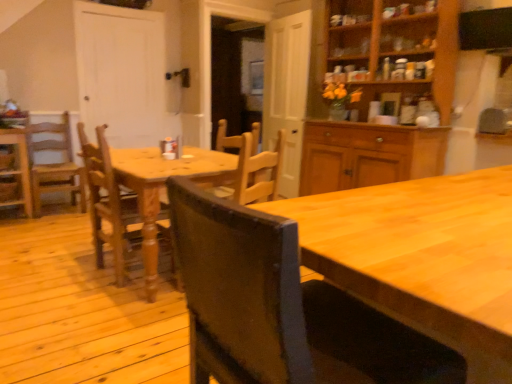
Locate an element on the screen. Image resolution: width=512 pixels, height=384 pixels. wooden chair at left, which is the 2th chair in back-to-front order is located at coordinates (19, 168).

Based on the photo, what is the approximate height of black matte exhaust hood at upper right?

30.41 centimeters.

Measure the distance between black matte exhaust hood at upper right and camera.

The depth of black matte exhaust hood at upper right is 3.24 meters.

You are a GUI agent. You are given a task and a screenshot of the screen. Output one action in this format:
    pyautogui.click(x=<x>, y=<y>)
    Task: Click on the wooden chair at center, the first chair when ordered from right to left
    The width and height of the screenshot is (512, 384).
    Given the screenshot: What is the action you would take?
    282,308

Where is `wooden table at center`? wooden table at center is located at coordinates (147, 196).

How different are the orientations of wooden chair at center, which appears as the second chair when viewed from the front, and black matte exhaust hood at upper right in degrees?

The angle between the facing direction of wooden chair at center, which appears as the second chair when viewed from the front, and the facing direction of black matte exhaust hood at upper right is 180 degrees.

Could you tell me if wooden chair at center, which ranks as the 3th chair in back-to-front order, is turned towards black matte exhaust hood at upper right?

No, wooden chair at center, which ranks as the 3th chair in back-to-front order, does not turn towards black matte exhaust hood at upper right.

From the image's perspective, is wooden chair at center, which ranks as the 3th chair in back-to-front order, positioned above or below black matte exhaust hood at upper right?

From the image's perspective, wooden chair at center, which ranks as the 3th chair in back-to-front order, appears below black matte exhaust hood at upper right.

I want to click on exhaust hood above the wooden chair at center, which appears as the 2th chair when viewed from the right (from a real-world perspective), so click(x=486, y=30).

Which is behind, wooden chair at left, which is the 2th chair in back-to-front order, or light brown wooden chair at left, the first chair positioned from the back?

light brown wooden chair at left, the first chair positioned from the back, is further from the camera.

You are a GUI agent. You are given a task and a screenshot of the screen. Output one action in this format:
    pyautogui.click(x=<x>, y=<y>)
    Task: Click on the chair beneath the light brown wooden chair at left, acting as the 4th chair starting from the front (from a real-world perspective)
    The width and height of the screenshot is (512, 384).
    Given the screenshot: What is the action you would take?
    pyautogui.click(x=19, y=168)

Which is behind, point (26, 173) or point (51, 132)?

The point (51, 132) is more distant.

Which is correct: wooden chair at left, the fourth chair viewed from the right, is inside light brown wooden chair at left, acting as the 4th chair starting from the front, or outside of it?

wooden chair at left, the fourth chair viewed from the right, is outside light brown wooden chair at left, acting as the 4th chair starting from the front.

What's the angular difference between wooden chair at center, placed as the third chair when sorted from left to right, and wooden table at center's facing directions?

The angular difference between wooden chair at center, placed as the third chair when sorted from left to right, and wooden table at center is 0.587 degrees.

Where is `kitchen & dining room table on the right of wooden chair at center, which appears as the 2th chair when viewed from the right`? Image resolution: width=512 pixels, height=384 pixels. kitchen & dining room table on the right of wooden chair at center, which appears as the 2th chair when viewed from the right is located at coordinates (147, 196).

Between wooden chair at center, placed as the third chair when sorted from left to right, and wooden table at center, which one has smaller width?

With smaller width is wooden chair at center, placed as the third chair when sorted from left to right.

Would you say wooden chair at center, placed as the third chair when sorted from left to right, contains wooden table at center?

Definitely not — wooden table at center is not inside wooden chair at center, placed as the third chair when sorted from left to right.

Is black matte exhaust hood at upper right wider than wooden chair at left, which is the first chair in left-to-right order?

In fact, black matte exhaust hood at upper right might be narrower than wooden chair at left, which is the first chair in left-to-right order.

Considering the positions of objects black matte exhaust hood at upper right and wooden chair at left, which is the 2th chair in back-to-front order, in the image provided, who is behind, black matte exhaust hood at upper right or wooden chair at left, which is the 2th chair in back-to-front order,?

wooden chair at left, which is the 2th chair in back-to-front order, is further from the camera.

This screenshot has width=512, height=384. In order to click on exhaust hood that is in front of the wooden chair at left, the fourth chair viewed from the right in this screenshot , I will do click(x=486, y=30).

Is light brown wooden chair at left, the first chair positioned from the back, inside the boundaries of wooden chair at left, the third chair in the front-to-back sequence, or outside?

light brown wooden chair at left, the first chair positioned from the back, is not inside wooden chair at left, the third chair in the front-to-back sequence, it's outside.

Is light brown wooden chair at left, the first chair positioned from the back, further to camera compared to wooden chair at left, the fourth chair viewed from the right?

Yes, it is behind wooden chair at left, the fourth chair viewed from the right.

Is light brown wooden chair at left, arranged as the third chair when viewed from the right, positioned far away from wooden chair at left, which is the first chair in left-to-right order?

No, light brown wooden chair at left, arranged as the third chair when viewed from the right, is in close proximity to wooden chair at left, which is the first chair in left-to-right order.

Can you tell me how much light brown wooden chair at left, arranged as the third chair when viewed from the right, and wooden chair at left, the fourth chair viewed from the right, differ in facing direction?

1.06 degrees.

From the image's perspective, is light brown wooden chair at left, placed as the second chair when sorted from left to right, on top of wooden table at center?

Yes.

Looking at this image, can you confirm if light brown wooden chair at left, arranged as the third chair when viewed from the right, is smaller than wooden table at center?

Yes, light brown wooden chair at left, arranged as the third chair when viewed from the right, is smaller than wooden table at center.

Identify the location of kitchen & dining room table that is under the light brown wooden chair at left, acting as the 4th chair starting from the front (from a real-world perspective). The image size is (512, 384). (147, 196).

Considering the relative positions of light brown wooden chair at left, acting as the 4th chair starting from the front, and wooden table at center in the image provided, is light brown wooden chair at left, acting as the 4th chair starting from the front, to the left of wooden table at center from the viewer's perspective?

Yes.

Is wooden cabinet at upper right oriented away from wooden table at center?

No, wooden cabinet at upper right is not facing the opposite direction of wooden table at center.

In the scene shown: Considering the relative positions of wooden cabinet at upper right and wooden table at center in the image provided, is wooden cabinet at upper right behind wooden table at center?

Yes, it is behind wooden table at center.

From a real-world perspective, is wooden cabinet at upper right positioned above or below wooden table at center?

From a real-world perspective, wooden cabinet at upper right is physically above wooden table at center.

The height and width of the screenshot is (384, 512). What are the coordinates of `kitchen & dining room table to the left of wooden cabinet at upper right` in the screenshot? It's located at (147, 196).

Where is `exhaust hood on the right of wooden chair at center, which appears as the 2th chair when viewed from the right`? exhaust hood on the right of wooden chair at center, which appears as the 2th chair when viewed from the right is located at coordinates (486, 30).

The height and width of the screenshot is (384, 512). What are the coordinates of `chair below the light brown wooden chair at left, arranged as the third chair when viewed from the right (from a real-world perspective)` in the screenshot? It's located at (19, 168).

Looking at the image, which one is located further to wooden chair at center, which ranks as the 3th chair in back-to-front order, black matte exhaust hood at upper right or light brown wooden chair at left, arranged as the third chair when viewed from the right?

black matte exhaust hood at upper right.

In the scene shown: Considering their positions, is wooden chair at center, the fourth chair positioned from the left, positioned closer to light brown wooden chair at left, placed as the second chair when sorted from left to right, than wooden chair at center, which ranks as the 3th chair in back-to-front order?

Among the two, wooden chair at center, which ranks as the 3th chair in back-to-front order, is located nearer to light brown wooden chair at left, placed as the second chair when sorted from left to right.

From the image, which object appears to be nearer to wooden chair at left, which is the 2th chair in back-to-front order, wooden chair at center, which ranks as the 3th chair in back-to-front order, or wooden table at center?

wooden chair at center, which ranks as the 3th chair in back-to-front order, lies closer to wooden chair at left, which is the 2th chair in back-to-front order, than the other object.

Considering their positions, is wooden chair at left, which is the 2th chair in back-to-front order, positioned further to light brown wooden chair at left, placed as the second chair when sorted from left to right, than wooden chair at center, which appears as the second chair when viewed from the front?

Based on the image, wooden chair at center, which appears as the second chair when viewed from the front, appears to be further to light brown wooden chair at left, placed as the second chair when sorted from left to right.

Based on their spatial positions, is wooden cabinet at upper right or wooden table at center further from wooden chair at center, the fourth chair positioned from the left?

wooden cabinet at upper right lies further to wooden chair at center, the fourth chair positioned from the left, than the other object.

Considering their positions, is wooden chair at center, the first chair when ordered from right to left, positioned closer to wooden cabinet at upper right than wooden table at center?

Based on the image, wooden table at center appears to be nearer to wooden cabinet at upper right.

Based on the photo, from the image, which object appears to be farther from wooden cabinet at upper right, black matte exhaust hood at upper right or wooden table at center?

wooden table at center.

Which object lies further to the anchor point wooden chair at center, which is the fourth chair in back-to-front order, black matte exhaust hood at upper right or light brown wooden chair at left, the first chair positioned from the back?

light brown wooden chair at left, the first chair positioned from the back, is further to wooden chair at center, which is the fourth chair in back-to-front order.

Where is `kitchen & dining room table between wooden chair at left, which is the first chair in left-to-right order, and black matte exhaust hood at upper right`? kitchen & dining room table between wooden chair at left, which is the first chair in left-to-right order, and black matte exhaust hood at upper right is located at coordinates (147, 196).

Where is `cabinetry located between wooden table at center and black matte exhaust hood at upper right in the left-right direction`? The width and height of the screenshot is (512, 384). cabinetry located between wooden table at center and black matte exhaust hood at upper right in the left-right direction is located at coordinates (381, 91).

Where is `kitchen & dining room table between light brown wooden chair at left, placed as the second chair when sorted from left to right, and black matte exhaust hood at upper right`? Image resolution: width=512 pixels, height=384 pixels. kitchen & dining room table between light brown wooden chair at left, placed as the second chair when sorted from left to right, and black matte exhaust hood at upper right is located at coordinates (147, 196).

Identify the location of kitchen & dining room table situated between wooden chair at center, which ranks as the 3th chair in back-to-front order, and black matte exhaust hood at upper right from left to right. The image size is (512, 384). (147, 196).